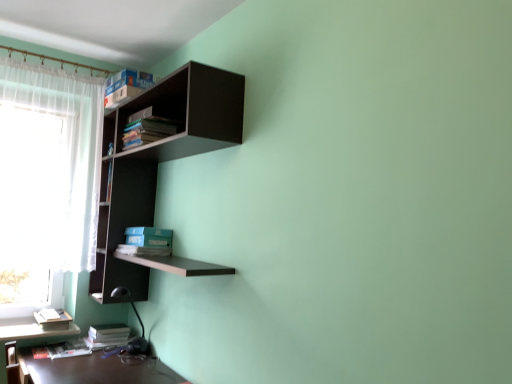
Question: Which direction should I rotate to look at blue matte bookshelf at center, the second book viewed from the top?

Choices:
 (A) left
 (B) right

Answer: (A)

Question: Is hardcover book at lower left, the first book positioned from the bottom, located within hardcover book at lower left, acting as the fourth book starting from the top?

Choices:
 (A) no
 (B) yes

Answer: (A)

Question: From a real-world perspective, is hardcover book at lower left, acting as the fourth book starting from the top, under hardcover book at lower left, the fifth book viewed from the top?

Choices:
 (A) yes
 (B) no

Answer: (B)

Question: Is hardcover book at lower left, the 2th book in the bottom-to-top sequence, smaller than hardcover book at lower left, the fifth book viewed from the top?

Choices:
 (A) yes
 (B) no

Answer: (B)

Question: Is hardcover book at lower left, the 2th book in the bottom-to-top sequence, bigger than hardcover book at lower left, the fifth book viewed from the top?

Choices:
 (A) yes
 (B) no

Answer: (A)

Question: Are hardcover book at lower left, acting as the fourth book starting from the top, and hardcover book at lower left, the first book positioned from the bottom, far apart?

Choices:
 (A) no
 (B) yes

Answer: (A)

Question: Is hardcover book at lower left, the 2th book in the bottom-to-top sequence, to the left of hardcover book at lower left, the fifth book viewed from the top, from the viewer's perspective?

Choices:
 (A) no
 (B) yes

Answer: (A)

Question: Does hardcover book at lower left, acting as the fourth book starting from the top, appear on the left side of blue matte bookshelf at center, the 4th book positioned from the bottom?

Choices:
 (A) no
 (B) yes

Answer: (B)

Question: From a real-world perspective, is hardcover book at lower left, the 2th book in the bottom-to-top sequence, physically below blue matte bookshelf at center, the second book viewed from the top?

Choices:
 (A) yes
 (B) no

Answer: (A)

Question: Is hardcover book at lower left, acting as the fourth book starting from the top, with blue matte bookshelf at center, the second book viewed from the top?

Choices:
 (A) no
 (B) yes

Answer: (A)

Question: Could you tell me if hardcover book at lower left, the 2th book in the bottom-to-top sequence, is facing blue matte bookshelf at center, the 4th book positioned from the bottom?

Choices:
 (A) no
 (B) yes

Answer: (A)

Question: From a real-world perspective, is hardcover book at lower left, the 2th book in the bottom-to-top sequence, physically above blue matte bookshelf at center, the second book viewed from the top?

Choices:
 (A) yes
 (B) no

Answer: (B)

Question: Does hardcover book at lower left, acting as the fourth book starting from the top, have a lesser width compared to blue matte bookshelf at center, the second book viewed from the top?

Choices:
 (A) yes
 (B) no

Answer: (B)

Question: Can you confirm if blue matte bookshelf at center, the second book viewed from the top, is positioned to the left of hardcover book at lower left, the first book positioned from the bottom?

Choices:
 (A) yes
 (B) no

Answer: (B)